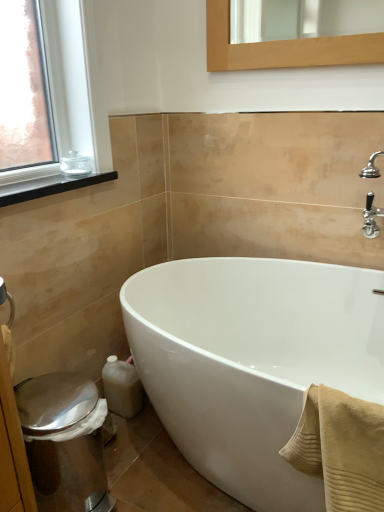
Question: Does shiny metallic bidet at lower left touch beige ribbed towel at lower right?

Choices:
 (A) yes
 (B) no

Answer: (B)

Question: Is shiny metallic bidet at lower left far from beige ribbed towel at lower right?

Choices:
 (A) no
 (B) yes

Answer: (A)

Question: From the image's perspective, is shiny metallic bidet at lower left on top of beige ribbed towel at lower right?

Choices:
 (A) no
 (B) yes

Answer: (A)

Question: From a real-world perspective, is shiny metallic bidet at lower left located beneath beige ribbed towel at lower right?

Choices:
 (A) no
 (B) yes

Answer: (B)

Question: From a real-world perspective, is shiny metallic bidet at lower left on beige ribbed towel at lower right?

Choices:
 (A) no
 (B) yes

Answer: (A)

Question: In terms of height, does beige ribbed towel at lower right look taller or shorter compared to black matte window sill at upper left?

Choices:
 (A) tall
 (B) short

Answer: (A)

Question: From a real-world perspective, is beige ribbed towel at lower right physically located above or below black matte window sill at upper left?

Choices:
 (A) below
 (B) above

Answer: (A)

Question: Do you think beige ribbed towel at lower right is within black matte window sill at upper left, or outside of it?

Choices:
 (A) outside
 (B) inside

Answer: (A)

Question: Based on their positions, is beige ribbed towel at lower right located to the left or right of black matte window sill at upper left?

Choices:
 (A) left
 (B) right

Answer: (B)

Question: Considering the positions of point (304, 418) and point (69, 164), is point (304, 418) closer or farther from the camera than point (69, 164)?

Choices:
 (A) closer
 (B) farther

Answer: (A)

Question: Is beige ribbed towel at lower right in front of or behind clear glass jar at upper left in the image?

Choices:
 (A) front
 (B) behind

Answer: (A)

Question: From the image's perspective, is beige ribbed towel at lower right located above or below clear glass jar at upper left?

Choices:
 (A) above
 (B) below

Answer: (B)

Question: Considering the positions of beige ribbed towel at lower right and clear glass jar at upper left in the image, is beige ribbed towel at lower right bigger or smaller than clear glass jar at upper left?

Choices:
 (A) big
 (B) small

Answer: (A)

Question: From their relative heights in the image, would you say shiny metallic bidet at lower left is taller or shorter than white glossy bathtub at center?

Choices:
 (A) tall
 (B) short

Answer: (B)

Question: Considering the positions of shiny metallic bidet at lower left and white glossy bathtub at center in the image, is shiny metallic bidet at lower left bigger or smaller than white glossy bathtub at center?

Choices:
 (A) small
 (B) big

Answer: (A)